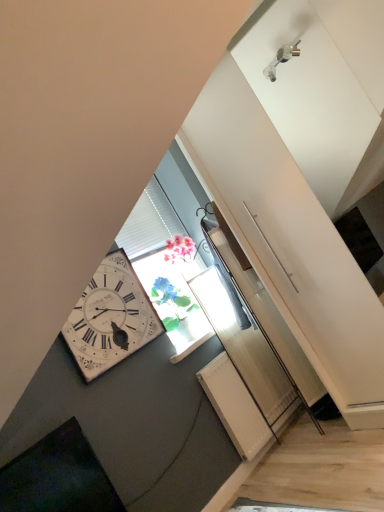
You are a GUI agent. You are given a task and a screenshot of the screen. Output one action in this format:
    pyautogui.click(x=<x>, y=<y>)
    Task: Click on the white wooden wall clock at lower left
    The width and height of the screenshot is (384, 512).
    Given the screenshot: What is the action you would take?
    pyautogui.click(x=111, y=317)

What is the approximate width of white wooden wall clock at lower left?

The width of white wooden wall clock at lower left is 1.46 inches.

What do you see at coordinates (111, 317) in the screenshot? The height and width of the screenshot is (512, 384). I see `white wooden wall clock at lower left` at bounding box center [111, 317].

Looking at this image, measure the distance between point (96, 332) and camera.

Point (96, 332) is 7.67 feet from camera.

Identify the location of white wooden wall clock at lower left. click(111, 317).